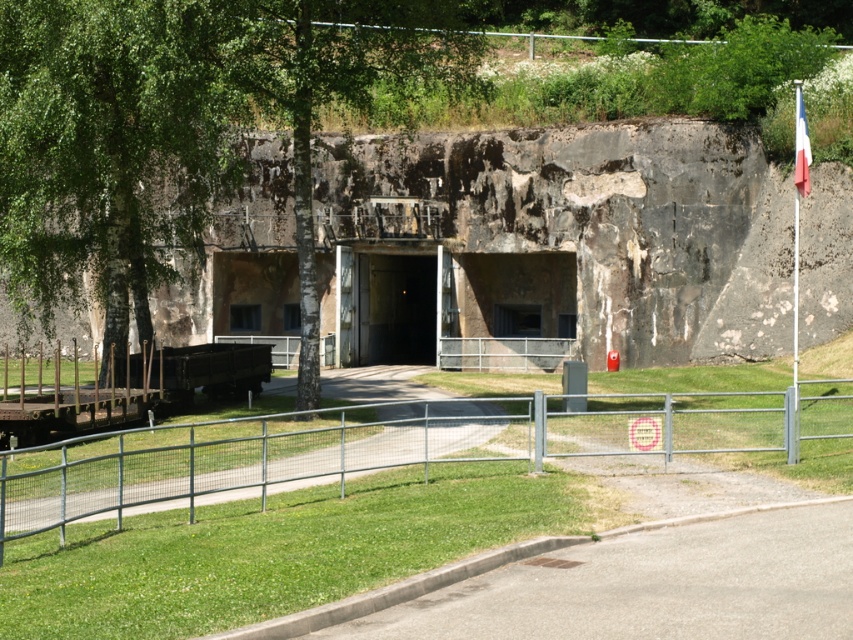
Is green leafy tree at center shorter than concrete bunker entrance at center?

No, green leafy tree at center is not shorter than concrete bunker entrance at center.

Can you confirm if green leafy tree at center is taller than concrete bunker entrance at center?

Indeed, green leafy tree at center has a greater height compared to concrete bunker entrance at center.

Is point (318, 346) positioned in front of point (525, 336)?

Yes, it is in front of point (525, 336).

In order to click on green leafy tree at center in this screenshot , I will do `click(332, 93)`.

Is green leafy tree at center taller than french flag at upper right?

Correct, green leafy tree at center is much taller as french flag at upper right.

Which is behind, point (252, 20) or point (799, 170)?

Positioned behind is point (799, 170).

Is point (312, 291) more distant than point (805, 148)?

That is True.

Where is `green leafy tree at center`? This screenshot has width=853, height=640. green leafy tree at center is located at coordinates (332, 93).

This screenshot has height=640, width=853. I want to click on green leafy tree at center, so click(x=332, y=93).

Does green leafy tree at center have a larger size compared to dark gray concrete tunnel at center?

Yes, green leafy tree at center is bigger than dark gray concrete tunnel at center.

Who is more distant from viewer, (386,28) or (372,307)?

Point (372,307)

I want to click on green leafy tree at center, so click(x=332, y=93).